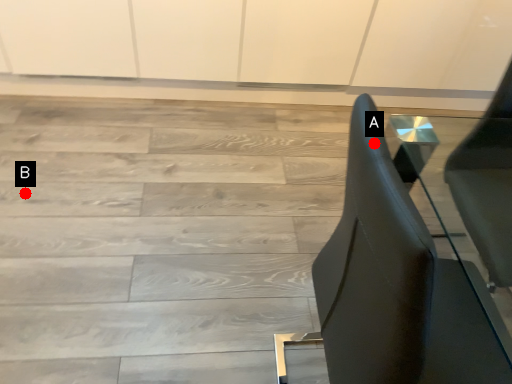
Question: Two points are circled on the image, labeled by A and B beside each circle. Which point is further to the camera?

Choices:
 (A) A is further
 (B) B is further

Answer: (B)